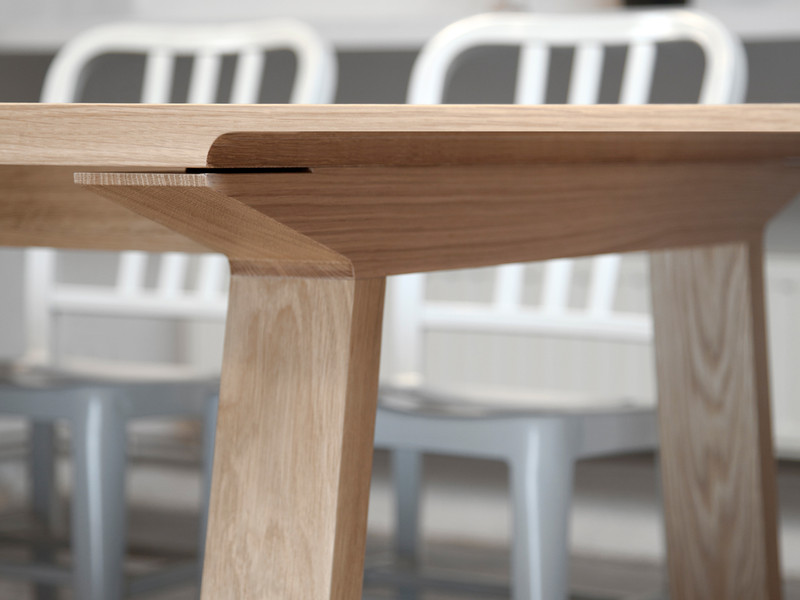
Locate an element on the screen. The width and height of the screenshot is (800, 600). rear chair leg is located at coordinates click(x=409, y=485), click(x=205, y=445), click(x=38, y=442).